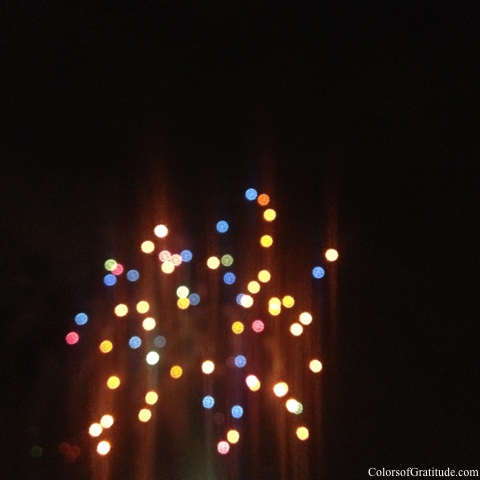
In order to click on pink lights in this screenshot , I will do `click(255, 329)`, `click(70, 338)`, `click(119, 269)`, `click(163, 256)`, `click(177, 261)`, `click(118, 271)`.